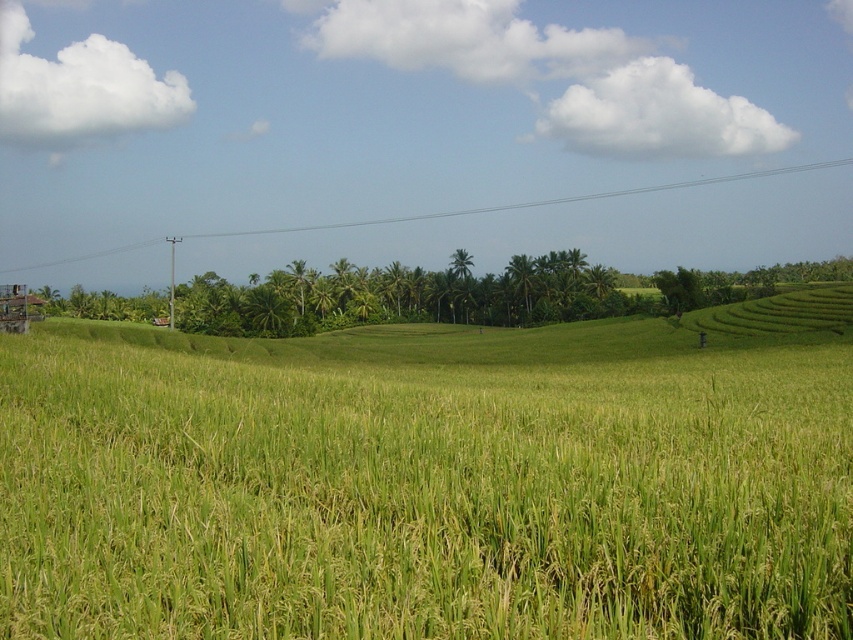
You are a drone operator flying a drone that needs to capture aerial footage of the green grassy field at center and the clear plastic power line at upper center. Based on their positions, which object will appear closer to the camera in the final footage?

The green grassy field at center will appear closer to the camera in the final footage because it is positioned in front of the clear plastic power line at upper center.